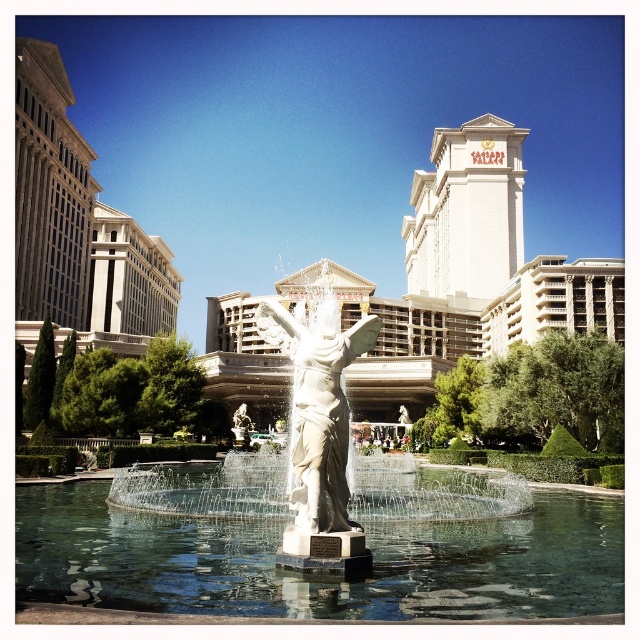
Question: Does clear glass water at center appear on the right side of white marble statue at center?

Choices:
 (A) no
 (B) yes

Answer: (A)

Question: Is clear glass water at center behind white marble statue at center?

Choices:
 (A) yes
 (B) no

Answer: (B)

Question: Can you confirm if clear glass water at center is thinner than white marble statue at center?

Choices:
 (A) yes
 (B) no

Answer: (B)

Question: Estimate the real-world distances between objects in this image. Which object is farther from the clear glass water at center?

Choices:
 (A) white marble fountain at center
 (B) white marble statue at center

Answer: (B)

Question: Based on their relative distances, which object is farther from the white marble fountain at center?

Choices:
 (A) clear glass water at center
 (B) white marble statue at center

Answer: (A)

Question: Which point is closer to the camera?

Choices:
 (A) clear glass water at center
 (B) white marble fountain at center
 (C) white marble statue at center

Answer: (A)